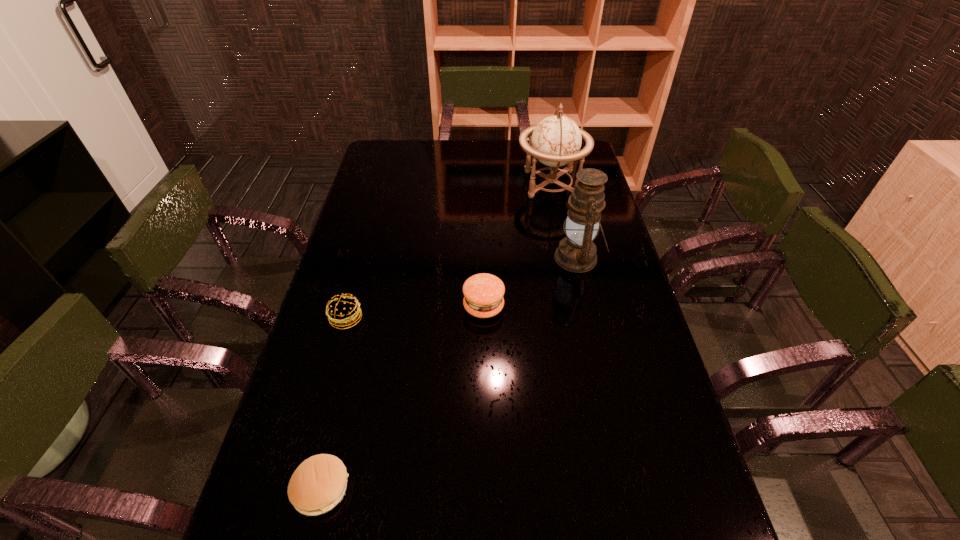
At what (x,y) coordinates should I click in order to perform the action: click on vacant space situated on the back of the oil lamp. Please return your answer as a coordinate pair (x, y). Looking at the image, I should click on (564, 194).

Find the location of a particular element. vacant point located on the left of the third shortest object is located at coordinates (360, 306).

Where is `free space located on the front of the second tallest patty`? free space located on the front of the second tallest patty is located at coordinates (314, 436).

Where is `blank space located on the right of the nearest object`? The width and height of the screenshot is (960, 540). blank space located on the right of the nearest object is located at coordinates (531, 488).

The height and width of the screenshot is (540, 960). What are the coordinates of `object that is at the far edge` in the screenshot? It's located at (556, 141).

Where is `globe that is at the right edge`? globe that is at the right edge is located at coordinates (556, 141).

Find the location of a particular element. The image size is (960, 540). oil lamp situated at the right edge is located at coordinates (576, 253).

Identify the location of object that is at the far right corner. Image resolution: width=960 pixels, height=540 pixels. (556, 141).

This screenshot has width=960, height=540. I want to click on free location at the far edge, so click(x=500, y=158).

The image size is (960, 540). Find the location of `free region at the left edge of the desktop`. free region at the left edge of the desktop is located at coordinates (324, 381).